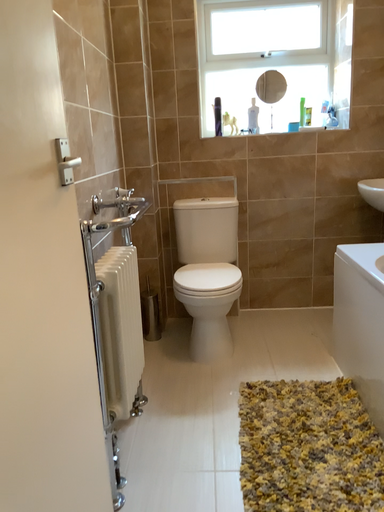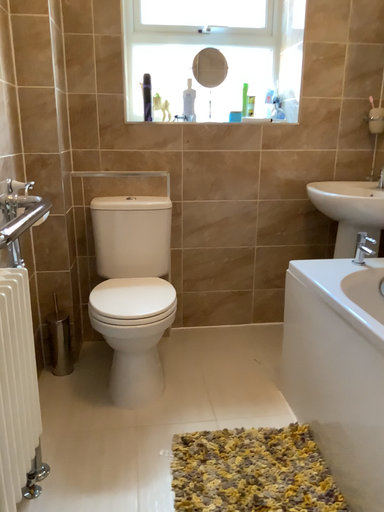
Question: Which way did the camera rotate in the video?

Choices:
 (A) rotated left
 (B) rotated right

Answer: (B)